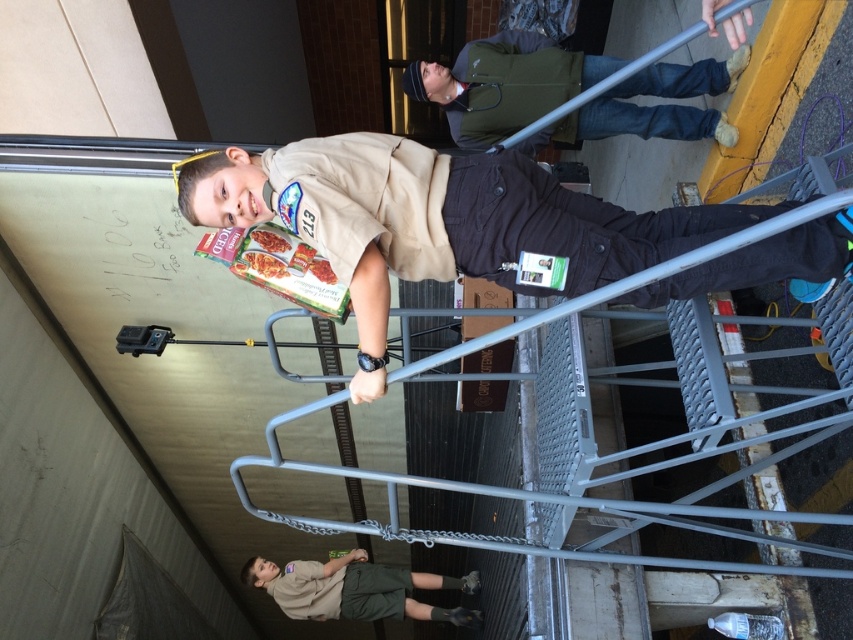
In the scene shown: You are a visitor at a Boy Scouts event and notice two staff members. One is wearing a matte brown uniform at center, and the other has a green fabric jacket at upper center. Which staff member is closer to you?

The matte brown uniform at center is closer to you because it is in front of the green fabric jacket at upper center.

You are standing at the point marked as point (456,262) in the image. If you want to walk towards the nearest staircase, which is 7.54 feet away from you, how many steps would you need to take if each step covers 2.5 feet?

The distance to the staircase is 7.54 feet. Each step covers 2.5 feet. Dividing 7.54 by 2.5 gives approximately 3.016 steps. Since you can only take whole steps, you would need to take 4 steps to reach the staircase.